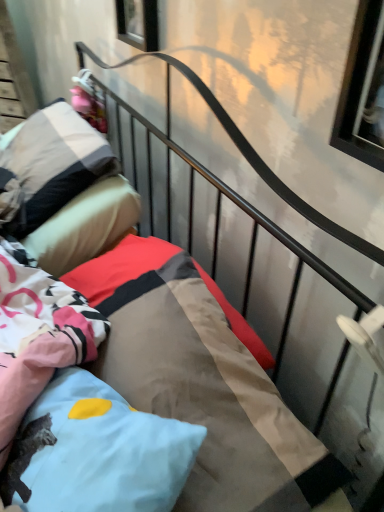
Question: Would you say light blue fabric pillow at center, the first pillow viewed from the front, is to the left or to the right of clear glass window at upper right, acting as the 2th window starting from the left, in the picture?

Choices:
 (A) right
 (B) left

Answer: (B)

Question: From a real-world perspective, is light blue fabric pillow at center, the first pillow viewed from the front, above or below clear glass window at upper right, which ranks as the 1th window in front-to-back order?

Choices:
 (A) below
 (B) above

Answer: (A)

Question: Which of these objects is positioned farthest from the light blue fabric pillow at center, which appears as the 2th pillow when viewed from the top?

Choices:
 (A) pink fabric doll at upper left
 (B) transparent glass window at upper center, which is the second window from front to back
 (C) clear glass window at upper right, which is the 2th window from top to bottom
 (D) soft cotton pillow at upper left, which is the 1th pillow in top-to-bottom order
 (E) textured cotton mattress at center

Answer: (A)

Question: Which object is the closest to the textured cotton mattress at center?

Choices:
 (A) light blue fabric pillow at center, which is the 2th pillow from back to front
 (B) transparent glass window at upper center, which is the second window from front to back
 (C) clear glass window at upper right, acting as the 2th window starting from the left
 (D) soft cotton pillow at upper left, which is the 1th pillow in top-to-bottom order
 (E) pink fabric doll at upper left

Answer: (A)